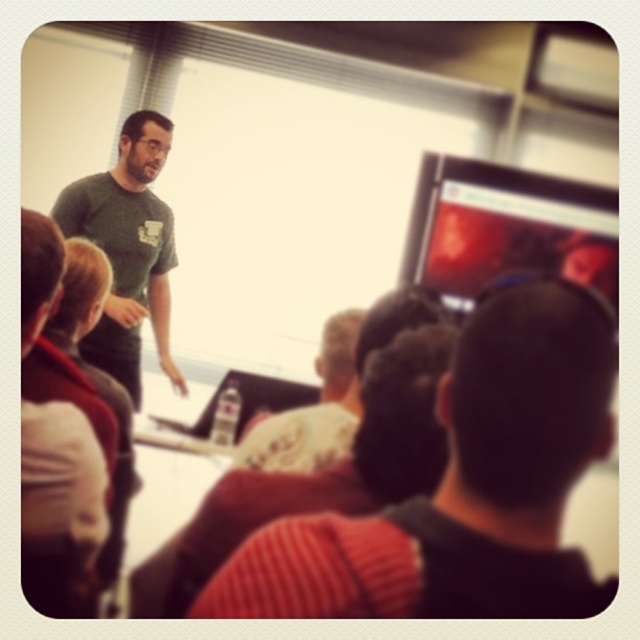
Question: Based on their relative distances, which object is farther from the white cotton shirt at center?

Choices:
 (A) green matte t-shirt at center
 (B) knitted red sweater at center
 (C) green t-shirt at upper left

Answer: (A)

Question: Is knitted red sweater at center closer to camera compared to green matte t-shirt at center?

Choices:
 (A) yes
 (B) no

Answer: (A)

Question: Does green t-shirt at upper left come behind green matte t-shirt at center?

Choices:
 (A) no
 (B) yes

Answer: (A)

Question: Is knitted red sweater at center to the right of green t-shirt at upper left from the viewer's perspective?

Choices:
 (A) yes
 (B) no

Answer: (A)

Question: Estimate the real-world distances between objects in this image. Which object is closer to the green t-shirt at upper left?

Choices:
 (A) white cotton shirt at center
 (B) knitted red sweater at center

Answer: (A)

Question: Which object is farther from the camera taking this photo?

Choices:
 (A) knitted red sweater at center
 (B) green matte t-shirt at center
 (C) white cotton shirt at center

Answer: (B)